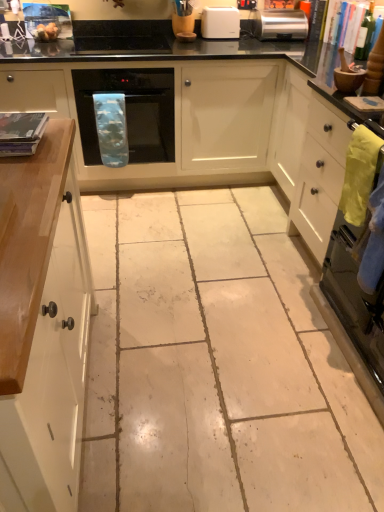
Image resolution: width=384 pixels, height=512 pixels. Find the location of `green glass bottle at upper right`. green glass bottle at upper right is located at coordinates (365, 35).

Locate an element on the screen. The width and height of the screenshot is (384, 512). black glass cooktop at upper center is located at coordinates (123, 45).

Describe the element at coordinates (355, 293) in the screenshot. This screenshot has height=512, width=384. I see `stainless steel oven at right` at that location.

Based on the photo, what is the approximate height of stainless steel oven at right?

stainless steel oven at right is 36.35 inches tall.

The image size is (384, 512). What do you see at coordinates (192, 52) in the screenshot?
I see `black glossy countertop at upper center` at bounding box center [192, 52].

What is the approximate width of satin silver toaster at upper right?

The width of satin silver toaster at upper right is 12.63 inches.

Identify the location of satin silver toaster at upper right. (280, 24).

The width and height of the screenshot is (384, 512). I want to click on green glass bottle at upper right, so click(365, 35).

Is point (13, 425) closer to viewer compared to point (358, 34)?

Yes, point (13, 425) is closer to viewer.

Which object is positioned more to the left, white glossy cabinet at left or green glass bottle at upper right?

white glossy cabinet at left is more to the left.

Considering the relative sizes of white glossy cabinet at left and green glass bottle at upper right in the image provided, is white glossy cabinet at left smaller than green glass bottle at upper right?

No.

Is white glossy cabinet at left wider or thinner than green glass bottle at upper right?

white glossy cabinet at left is wider than green glass bottle at upper right.

Is the position of green glass bottle at upper right less distant than that of white glossy cabinet at left?

No, green glass bottle at upper right is further to the viewer.

Is green glass bottle at upper right far from white glossy cabinet at left?

green glass bottle at upper right is far away from white glossy cabinet at left.

Where is `bottle above the white glossy cabinet at left (from the image's perspective)`? Image resolution: width=384 pixels, height=512 pixels. bottle above the white glossy cabinet at left (from the image's perspective) is located at coordinates (365, 35).

Looking at this image, is stainless steel oven at right bigger or smaller than satin silver toaster at upper right?

stainless steel oven at right is bigger than satin silver toaster at upper right.

Does stainless steel oven at right have a greater height compared to satin silver toaster at upper right?

Correct, stainless steel oven at right is much taller as satin silver toaster at upper right.

Is stainless steel oven at right positioned with its back to satin silver toaster at upper right?

stainless steel oven at right is not turned away from satin silver toaster at upper right.

Considering the positions of objects stainless steel oven at right and satin silver toaster at upper right in the image provided, who is behind, stainless steel oven at right or satin silver toaster at upper right?

satin silver toaster at upper right.

Choose the correct answer: Is white glossy cabinet at left inside black glossy countertop at upper center or outside it?

white glossy cabinet at left is not inside black glossy countertop at upper center, it's outside.

Relative to black glossy countertop at upper center, is white glossy cabinet at left in front or behind?

Visually, white glossy cabinet at left is located in front of black glossy countertop at upper center.

Is white glossy cabinet at left not near black glossy countertop at upper center?

Yes, white glossy cabinet at left and black glossy countertop at upper center are located far from each other.

Considering the relative sizes of white glossy cabinet at left and black glossy countertop at upper center in the image provided, is white glossy cabinet at left smaller than black glossy countertop at upper center?

Yes.

Consider the image. From a real-world perspective, is black glossy countertop at upper center above or below black glass cooktop at upper center?

black glossy countertop at upper center is situated lower than black glass cooktop at upper center in the real world.

Between black glossy countertop at upper center and black glass cooktop at upper center, which one has larger width?

Wider between the two is black glossy countertop at upper center.

Would you say black glossy countertop at upper center is to the left or to the right of black glass cooktop at upper center in the picture?

black glossy countertop at upper center is to the right of black glass cooktop at upper center.

Which object is more forward, black glossy countertop at upper center or black glass cooktop at upper center?

black glossy countertop at upper center is closer to the camera.

Considering the relative positions of black glass cooktop at upper center and satin silver toaster at upper right in the image provided, is black glass cooktop at upper center to the left or to the right of satin silver toaster at upper right?

Based on their positions, black glass cooktop at upper center is located to the left of satin silver toaster at upper right.

From a real-world perspective, who is located lower, black glass cooktop at upper center or satin silver toaster at upper right?

black glass cooktop at upper center, from a real-world perspective.

Where is `toaster that is above the black glass cooktop at upper center (from the image's perspective)`? toaster that is above the black glass cooktop at upper center (from the image's perspective) is located at coordinates (280, 24).

Find the location of a particular element. The width and height of the screenshot is (384, 512). home appliance that is behind the stainless steel oven at right is located at coordinates (130, 111).

Between black glass oven at center and stainless steel oven at right, which one is positioned in front?

stainless steel oven at right is closer to the camera.

Is black glass oven at center positioned with its back to stainless steel oven at right?

black glass oven at center is not turned away from stainless steel oven at right.

Which of these two, black glass oven at center or stainless steel oven at right, is thinner?

stainless steel oven at right is thinner.

Locate an element on the screen. Image resolution: width=384 pixels, height=512 pixels. cabinetry on the left side of green glass bottle at upper right is located at coordinates (42, 325).

Find the location of a particular element. bottle that is behind the white glossy cabinet at left is located at coordinates (365, 35).

Considering their positions, is stainless steel oven at right positioned further to green glass bottle at upper right than black glass oven at center?

The object further to green glass bottle at upper right is stainless steel oven at right.

Which object lies further to the anchor point white plastic toaster at upper center, stainless steel oven at right or black glass cooktop at upper center?

stainless steel oven at right lies further to white plastic toaster at upper center than the other object.

Which object lies further to the anchor point satin silver toaster at upper right, black glass cooktop at upper center or white glossy cabinet at left?

white glossy cabinet at left is positioned further to the anchor satin silver toaster at upper right.

Looking at the image, which one is located closer to black glass cooktop at upper center, black glass oven at center or white plastic toaster at upper center?

Based on the image, black glass oven at center appears to be nearer to black glass cooktop at upper center.

Estimate the real-world distances between objects in this image. Which object is closer to stainless steel oven at right, black glass oven at center or green glass bottle at upper right?

green glass bottle at upper right is positioned closer to the anchor stainless steel oven at right.

Based on their spatial positions, is white glossy cabinet at left or black glossy countertop at upper center closer to stainless steel oven at right?

black glossy countertop at upper center lies closer to stainless steel oven at right than the other object.

From the image, which object appears to be farther from black glass cooktop at upper center, black glossy countertop at upper center or stainless steel oven at right?

Based on the image, stainless steel oven at right appears to be further to black glass cooktop at upper center.

Based on their spatial positions, is green glass bottle at upper right or black glass oven at center further from stainless steel oven at right?

black glass oven at center lies further to stainless steel oven at right than the other object.

Locate an element on the screen. This screenshot has width=384, height=512. home appliance between black glass cooktop at upper center and black glossy countertop at upper center from left to right is located at coordinates (130, 111).

Image resolution: width=384 pixels, height=512 pixels. Find the location of `home appliance located between white glossy cabinet at left and satin silver toaster at upper right in the depth direction`. home appliance located between white glossy cabinet at left and satin silver toaster at upper right in the depth direction is located at coordinates (130, 111).

Locate an element on the screen. Image resolution: width=384 pixels, height=512 pixels. toaster between white glossy cabinet at left and white plastic toaster at upper center along the z-axis is located at coordinates (280, 24).

The image size is (384, 512). I want to click on bottle between white glossy cabinet at left and black glass oven at center along the z-axis, so click(x=365, y=35).